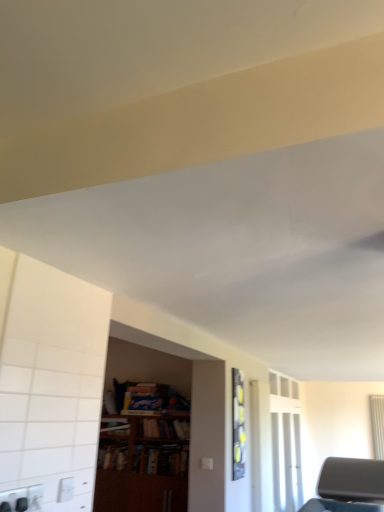
Question: Choose the correct answer: Is wooden bookshelf at center inside transparent glass door at right or outside it?

Choices:
 (A) outside
 (B) inside

Answer: (A)

Question: Based on their sizes in the image, would you say wooden bookshelf at center is bigger or smaller than transparent glass door at right?

Choices:
 (A) small
 (B) big

Answer: (A)

Question: Which of these objects is positioned farthest from the wooden bookshelf at center?

Choices:
 (A) transparent glass door at right
 (B) wooden bookcase at center
 (C) white plastic electric outlet at lower left

Answer: (C)

Question: Which is farther from the transparent glass door at right?

Choices:
 (A) wooden bookcase at center
 (B) white plastic electric outlet at lower left
 (C) wooden bookshelf at center

Answer: (B)